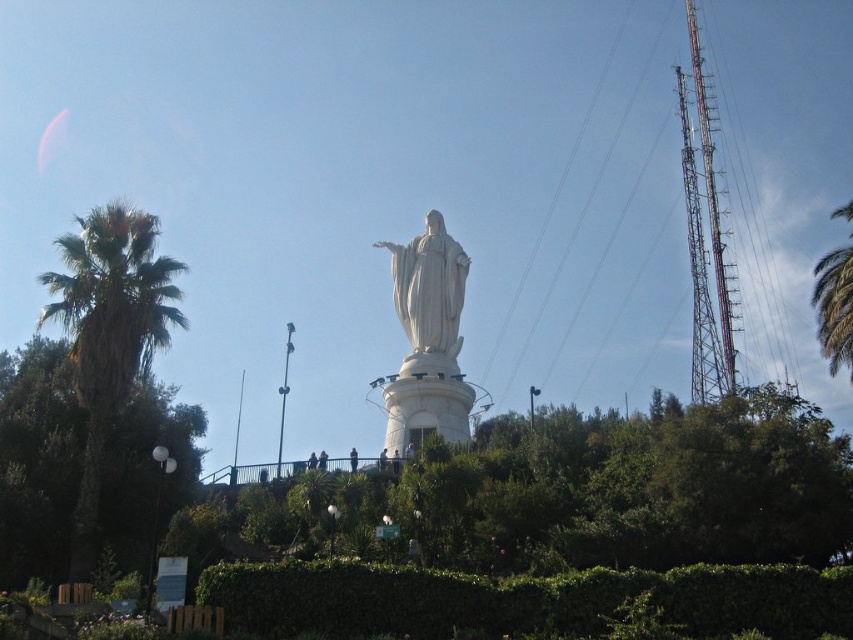
Based on the coordinates provided, where is the green leafy tree at left located in the image?

The green leafy tree at left is located at the 2D coordinates point (38, 461).

You are a photographer planning to capture the white marble statue at center and the green leafy tree at center in a single shot. Based on their sizes, which object should you focus on first to ensure both are clearly visible in the photo?

The green leafy tree at center is shorter than the white marble statue at center, so you should focus on the white marble statue at center first as it is taller and will require more attention to capture its details clearly while ensuring the shorter tree remains in frame.

You are standing at the base of the statue and want to walk towards the point labeled point (509, 470). Will you pass by point (109, 344) first?

Yes, because point (509, 470) is behind point (109, 344), so you will pass point (109, 344) first on your way to the other point.